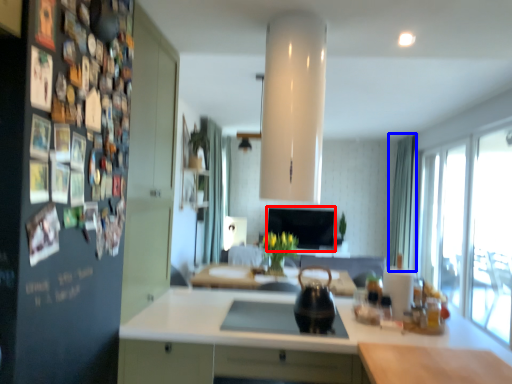
Question: Which of the following is the closest to the observer, window screen (highlighted by a red box) or curtain (highlighted by a blue box)?

Choices:
 (A) window screen
 (B) curtain

Answer: (B)